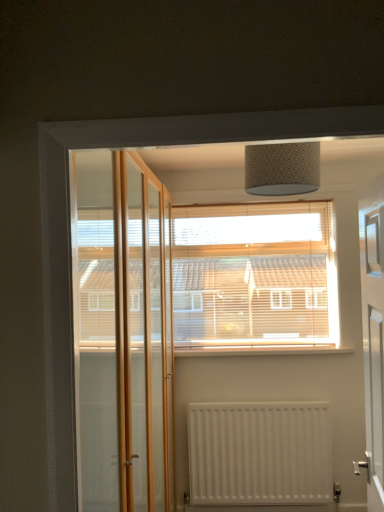
Question: Is point (213, 225) closer or farther from the camera than point (380, 259)?

Choices:
 (A) farther
 (B) closer

Answer: (A)

Question: Looking at their shapes, would you say wooden blinds at center is wider or thinner than white glossy door at right?

Choices:
 (A) thin
 (B) wide

Answer: (A)

Question: Considering the real-world distances, which object is farthest from the wooden blinds at center?

Choices:
 (A) white painted wood at center
 (B) white matte radiator at lower center
 (C) white glossy door at right

Answer: (B)

Question: Which is nearer to the wooden blinds at center?

Choices:
 (A) white painted wood at center
 (B) white glossy door at right
 (C) white matte radiator at lower center

Answer: (A)